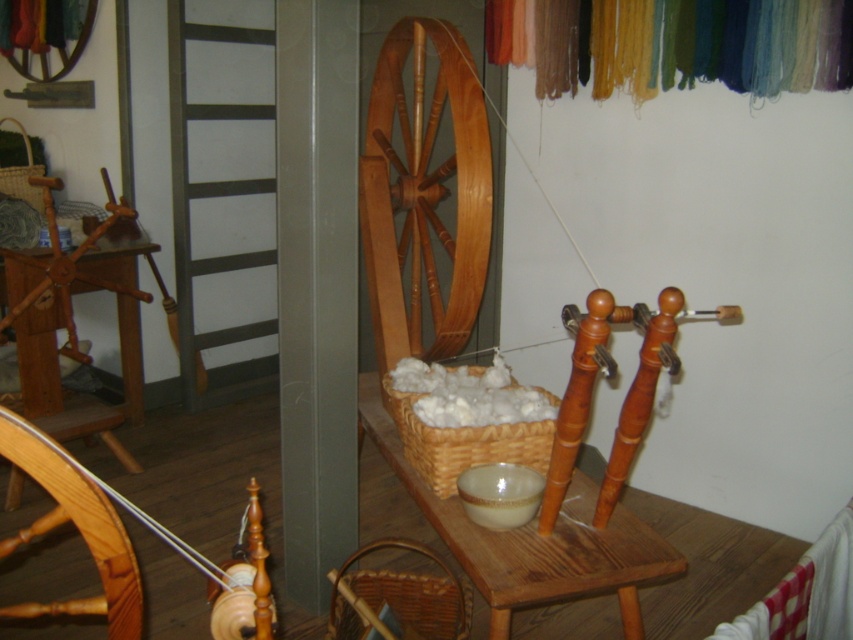
Is silky woolen yarns at upper right thinner than white fluffy wool at center?

No, silky woolen yarns at upper right is not thinner than white fluffy wool at center.

Who is higher up, silky woolen yarns at upper right or white fluffy wool at center?

silky woolen yarns at upper right is higher up.

Describe the element at coordinates (727, 44) in the screenshot. I see `silky woolen yarns at upper right` at that location.

Identify the location of silky woolen yarns at upper right. (727, 44).

The height and width of the screenshot is (640, 853). I want to click on woven brown basket at lower center, so click(x=399, y=596).

Is point (450, 600) positioned in front of point (529, 449)?

Yes, point (450, 600) is closer to viewer.

Is point (440, 637) positioned behind point (543, 452)?

No, it is in front of (543, 452).

Locate an element on the screen. The height and width of the screenshot is (640, 853). woven brown basket at lower center is located at coordinates (399, 596).

Which is behind, point (129, 630) or point (401, 388)?

The point (401, 388) is behind.

Does wooden spinning wheel at lower left appear on the left side of white fluffy wool at center?

Correct, you'll find wooden spinning wheel at lower left to the left of white fluffy wool at center.

You are a GUI agent. You are given a task and a screenshot of the screen. Output one action in this format:
    pyautogui.click(x=<x>, y=<y>)
    Task: Click on the wooden spinning wheel at lower left
    The width and height of the screenshot is (853, 640).
    Given the screenshot: What is the action you would take?
    pyautogui.click(x=76, y=528)

You are a GUI agent. You are given a task and a screenshot of the screen. Output one action in this format:
    pyautogui.click(x=<x>, y=<y>)
    Task: Click on the wooden spinning wheel at lower left
    This screenshot has height=640, width=853.
    Given the screenshot: What is the action you would take?
    pyautogui.click(x=76, y=528)